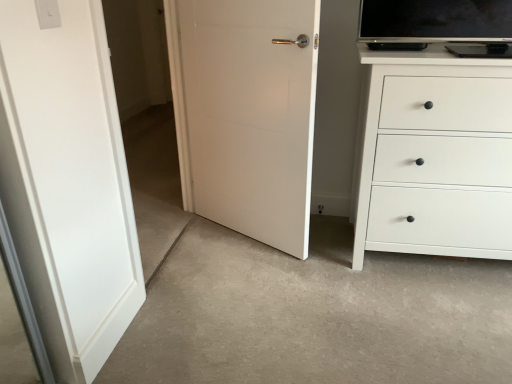
Question: Can you confirm if white plastic light switch at upper left is positioned to the left of transparent glass door at left?

Choices:
 (A) no
 (B) yes

Answer: (B)

Question: From a real-world perspective, is white plastic light switch at upper left beneath transparent glass door at left?

Choices:
 (A) no
 (B) yes

Answer: (A)

Question: Can you confirm if white plastic light switch at upper left is wider than transparent glass door at left?

Choices:
 (A) yes
 (B) no

Answer: (B)

Question: Considering the relative sizes of white plastic light switch at upper left and transparent glass door at left in the image provided, is white plastic light switch at upper left shorter than transparent glass door at left?

Choices:
 (A) no
 (B) yes

Answer: (B)

Question: Is white plastic light switch at upper left thinner than transparent glass door at left?

Choices:
 (A) no
 (B) yes

Answer: (B)

Question: Relative to white matte chest of drawers at right, is white plastic light switch at upper left in front or behind?

Choices:
 (A) behind
 (B) front

Answer: (B)

Question: From a real-world perspective, is white plastic light switch at upper left above or below white matte chest of drawers at right?

Choices:
 (A) below
 (B) above

Answer: (B)

Question: From the image's perspective, is white plastic light switch at upper left above or below white matte chest of drawers at right?

Choices:
 (A) below
 (B) above

Answer: (B)

Question: In the image, is white plastic light switch at upper left on the left side or the right side of white matte chest of drawers at right?

Choices:
 (A) right
 (B) left

Answer: (B)

Question: From their relative heights in the image, would you say white matte door at center is taller or shorter than white matte chest of drawers at right?

Choices:
 (A) tall
 (B) short

Answer: (A)

Question: From a real-world perspective, relative to white matte chest of drawers at right, is white matte door at center vertically above or below?

Choices:
 (A) below
 (B) above

Answer: (B)

Question: Considering the positions of white matte door at center and white matte chest of drawers at right in the image, is white matte door at center bigger or smaller than white matte chest of drawers at right?

Choices:
 (A) small
 (B) big

Answer: (A)

Question: Visually, is white matte door at center positioned to the left or to the right of white matte chest of drawers at right?

Choices:
 (A) right
 (B) left

Answer: (B)

Question: From the image's perspective, is white plastic light switch at upper left above or below transparent glass door at left?

Choices:
 (A) above
 (B) below

Answer: (A)

Question: From a real-world perspective, is white plastic light switch at upper left above or below transparent glass door at left?

Choices:
 (A) above
 (B) below

Answer: (A)